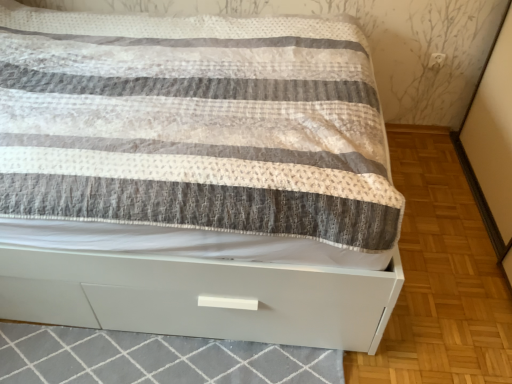
Question: From the image's perspective, does white glossy bed at center appear lower than white glossy drawer at lower center?

Choices:
 (A) no
 (B) yes

Answer: (A)

Question: From a real-world perspective, is white glossy bed at center under white glossy drawer at lower center?

Choices:
 (A) no
 (B) yes

Answer: (A)

Question: Is the position of white glossy bed at center more distant than that of white glossy drawer at lower center?

Choices:
 (A) no
 (B) yes

Answer: (A)

Question: Can you confirm if white glossy bed at center is taller than white glossy drawer at lower center?

Choices:
 (A) yes
 (B) no

Answer: (A)

Question: Is white glossy bed at center outside white glossy drawer at lower center?

Choices:
 (A) yes
 (B) no

Answer: (A)

Question: Is white glossy bed at center in contact with white glossy drawer at lower center?

Choices:
 (A) no
 (B) yes

Answer: (A)

Question: From a real-world perspective, is white glossy drawer at lower center under white glossy bed at center?

Choices:
 (A) no
 (B) yes

Answer: (B)

Question: Considering the relative positions of white glossy drawer at lower center and white glossy bed at center in the image provided, is white glossy drawer at lower center to the right of white glossy bed at center from the viewer's perspective?

Choices:
 (A) yes
 (B) no

Answer: (A)

Question: Is white glossy drawer at lower center outside of white glossy bed at center?

Choices:
 (A) no
 (B) yes

Answer: (B)

Question: Is white glossy drawer at lower center not near white glossy bed at center?

Choices:
 (A) yes
 (B) no

Answer: (B)

Question: Can you confirm if white glossy drawer at lower center is positioned to the left of white glossy bed at center?

Choices:
 (A) yes
 (B) no

Answer: (B)

Question: Is white glossy drawer at lower center looking in the opposite direction of white glossy bed at center?

Choices:
 (A) yes
 (B) no

Answer: (B)

Question: Do you think white glossy bed at center is within white glossy drawer at lower center, or outside of it?

Choices:
 (A) outside
 (B) inside

Answer: (A)